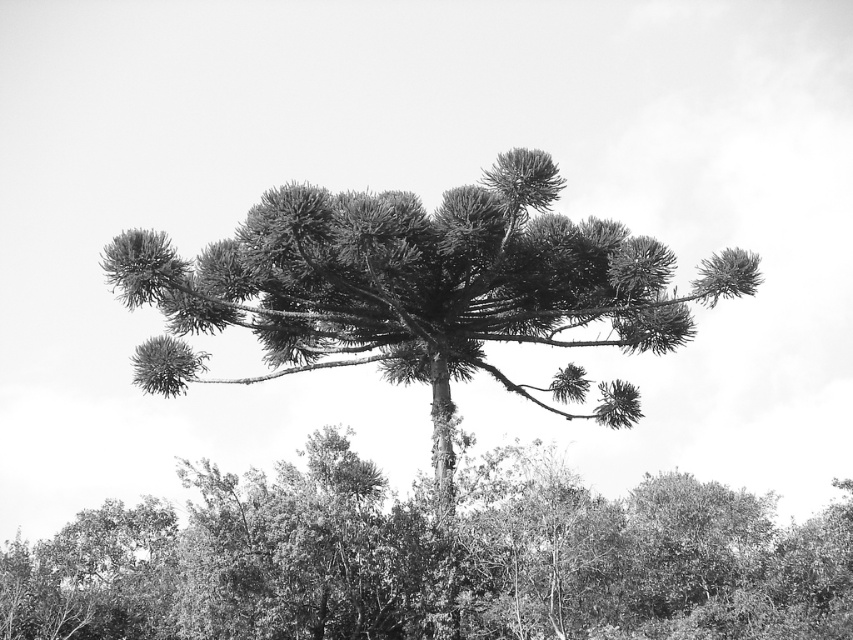
Can you confirm if dark green textured tree at center is shorter than dark green textured pine at center?

Yes.

Between dark green textured tree at center and dark green textured pine at center, which one has less height?

dark green textured tree at center

Who is more distant from viewer, (758, 538) or (554, 344)?

The point (758, 538) is more distant.

Find the location of `dark green textured tree at center`. dark green textured tree at center is located at coordinates tap(433, 560).